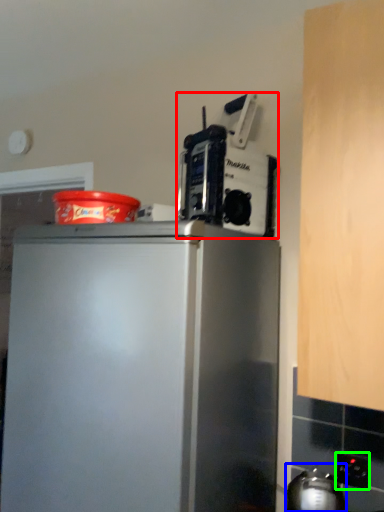
Question: Estimate the real-world distances between objects in this image. Which object is closer to kitchen appliance (highlighted by a red box), appliance (highlighted by a blue box) or electric outlet (highlighted by a green box)?

Choices:
 (A) appliance
 (B) electric outlet

Answer: (A)